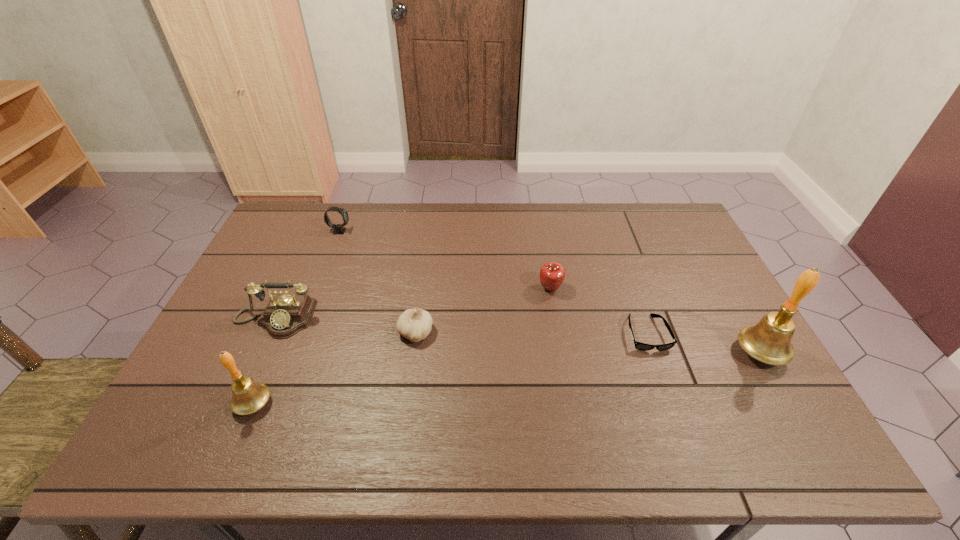
To achieve uniform spacing by inserting another bell among them, please point to a free space for this new bell. Please provide its 2D coordinates. Your answer should be formatted as a tuple, i.e. [(x, y)], where the tuple contains the x and y coordinates of a point satisfying the conditions above.

[(519, 377)]